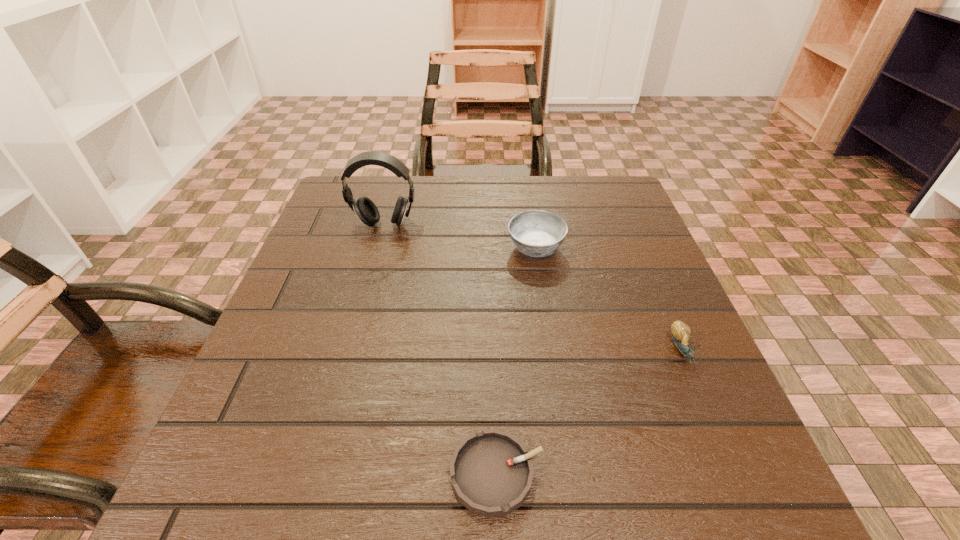
This screenshot has width=960, height=540. Identify the location of vacant region between the farther ashtray and the nearest object. (516, 361).

Identify the location of empty space that is in between the second shortest object and the nearest object. (589, 411).

You are a GUI agent. You are given a task and a screenshot of the screen. Output one action in this format:
    pyautogui.click(x=<x>, y=<y>)
    Task: Click on the vacant space in between the rightmost object and the taller ashtray
    The width and height of the screenshot is (960, 540).
    Given the screenshot: What is the action you would take?
    pyautogui.click(x=609, y=299)

Locate an element on the screen. This screenshot has width=960, height=540. free space between the shortest object and the leftmost object is located at coordinates (441, 349).

You are a GUI agent. You are given a task and a screenshot of the screen. Output one action in this format:
    pyautogui.click(x=<x>, y=<y>)
    Task: Click on the object that ranks as the second closest to the farther ashtray
    Image resolution: width=960 pixels, height=540 pixels.
    Given the screenshot: What is the action you would take?
    pyautogui.click(x=681, y=332)

The width and height of the screenshot is (960, 540). I want to click on object that is the closest to the earphone, so click(537, 233).

Image resolution: width=960 pixels, height=540 pixels. Find the location of `free space that satisfies the following two spatial constraints: 1. on the ear cups of the tallest object; 2. on the right side of the taller ashtray`. free space that satisfies the following two spatial constraints: 1. on the ear cups of the tallest object; 2. on the right side of the taller ashtray is located at coordinates (378, 248).

Where is `vacant region that satisfies the following two spatial constraints: 1. on the ear cups of the tallest object; 2. on the right side of the farther ashtray`? vacant region that satisfies the following two spatial constraints: 1. on the ear cups of the tallest object; 2. on the right side of the farther ashtray is located at coordinates [378, 248].

The height and width of the screenshot is (540, 960). I want to click on free spot that satisfies the following two spatial constraints: 1. on the ear cups of the farther ashtray; 2. on the right side of the leftmost object, so click(x=378, y=248).

Identify the location of blank space that satisfies the following two spatial constraints: 1. on the ear cups of the tallest object; 2. on the left side of the taller ashtray. (378, 248).